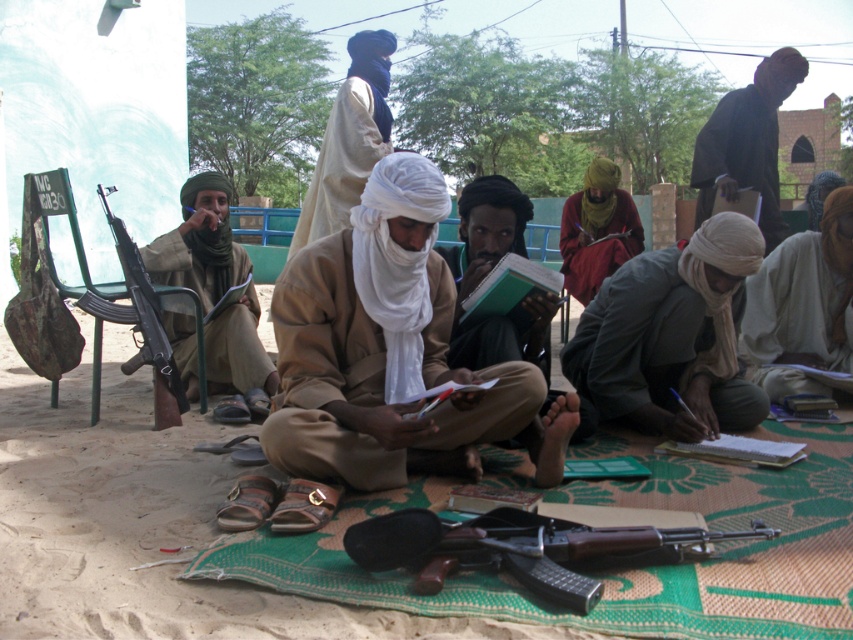
You are a traveler who just arrived in this desert area and you see the dark brown leather jacket at upper right and the beige cotton robe at center. Considering the weather, which item would you expect to be more appropriate to wear?

The beige cotton robe at center is more appropriate to wear in the desert because it is lighter and breathable, while the dark brown leather jacket at upper right, being darker and made of leather, might retain more heat and be less suitable for the hot environment.

You are a photographer standing in front of the study session scene. You want to take a photo that includes both the point at [50,611] and the point at [514,193]. Which point should you focus on to ensure both are in sharp focus?

To ensure both points are in sharp focus, focus on the point that is further away from the camera, which is point [514,193]. This is because focusing on the farther point will include the closer point within the depth of field.

In the scene shown: You are standing in front of the beige cotton turban at center and want to reach it without moving your feet. Can you touch it with your outstretched hand?

The beige cotton turban at center is 2.57 meters from viewer, so no, you cannot touch it with your outstretched hand since the average human arm length is about 0.7 meters.